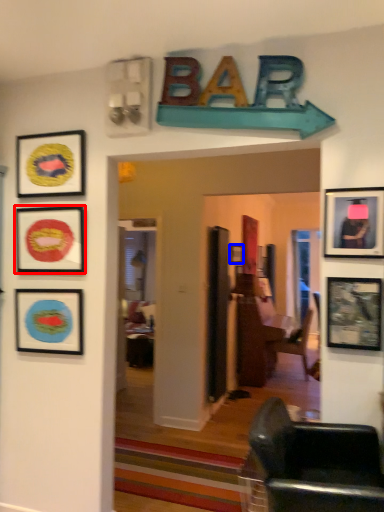
Question: Among these objects, which one is nearest to the camera, picture frame (highlighted by a red box) or picture frame (highlighted by a blue box)?

Choices:
 (A) picture frame
 (B) picture frame

Answer: (A)